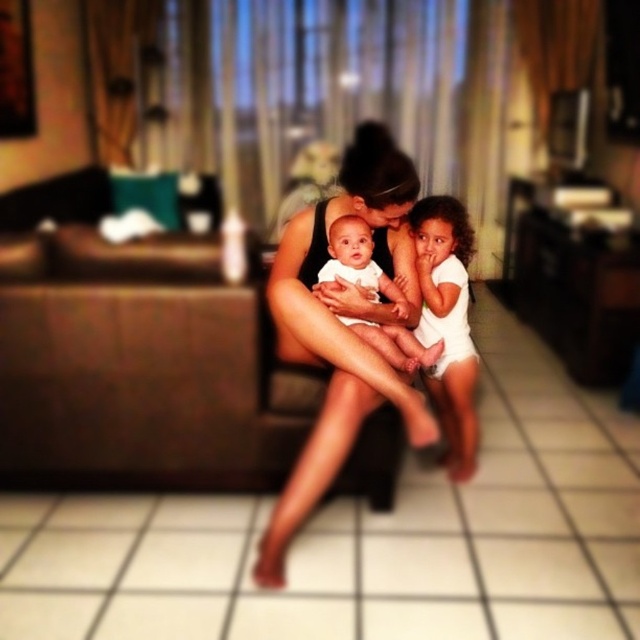
Question: Which object is positioned farthest from the matte black tank top at center?

Choices:
 (A) white cotton onesie at center
 (B) white matte baby at center

Answer: (A)

Question: Which object is the farthest from the matte black tank top at center?

Choices:
 (A) white cotton onesie at center
 (B) white matte baby at center

Answer: (A)

Question: Does matte black tank top at center come behind white matte baby at center?

Choices:
 (A) no
 (B) yes

Answer: (A)

Question: Does matte black tank top at center appear under white matte baby at center?

Choices:
 (A) yes
 (B) no

Answer: (A)

Question: Estimate the real-world distances between objects in this image. Which object is closer to the white matte baby at center?

Choices:
 (A) matte black tank top at center
 (B) white cotton onesie at center

Answer: (A)

Question: Is matte black tank top at center further to the viewer compared to white cotton onesie at center?

Choices:
 (A) no
 (B) yes

Answer: (A)